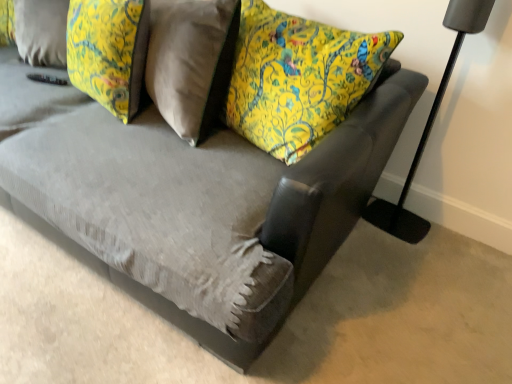
You are a GUI agent. You are given a task and a screenshot of the screen. Output one action in this format:
    pyautogui.click(x=<x>, y=<y>)
    Task: Click on the vacant area that lies to the right of matte black floor lamp at right
    This screenshot has width=512, height=384.
    Given the screenshot: What is the action you would take?
    pyautogui.click(x=442, y=237)